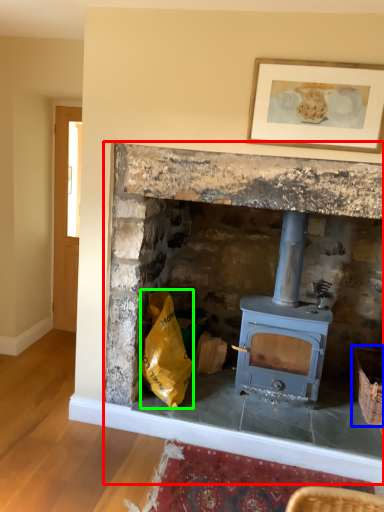
Question: Which object is positioned farthest from fireplace (highlighted by a red box)? Select from basket (highlighted by a blue box) and material (highlighted by a green box).

Choices:
 (A) basket
 (B) material

Answer: (A)